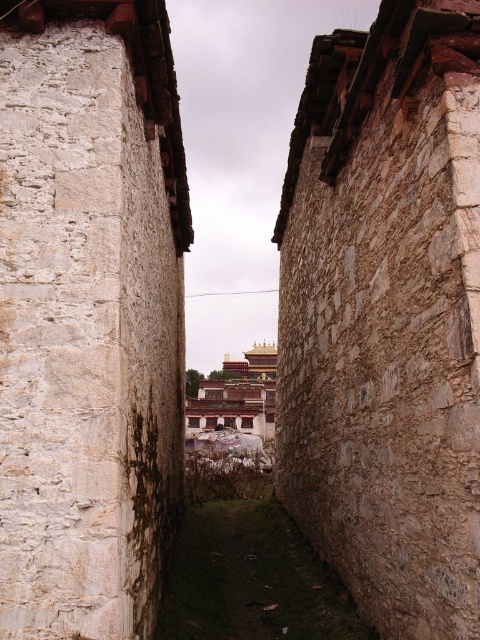
Who is lower down, brown stone wall at right or white stone wall at center?

brown stone wall at right is lower down.

The image size is (480, 640). What do you see at coordinates (386, 316) in the screenshot? I see `brown stone wall at right` at bounding box center [386, 316].

What are the coordinates of `brown stone wall at right` in the screenshot? It's located at [x=386, y=316].

Does white stone wall at center appear on the left side of white stone monastery at center?

No, white stone wall at center is not to the left of white stone monastery at center.

Who is more forward, (95, 628) or (233, 397)?

Point (95, 628) is more forward.

The image size is (480, 640). In order to click on white stone wall at center in this screenshot , I will do `click(88, 314)`.

Is brown stone wall at right shorter than white stone monastery at center?

In fact, brown stone wall at right may be taller than white stone monastery at center.

Locate an element on the screen. The width and height of the screenshot is (480, 640). brown stone wall at right is located at coordinates (386, 316).

Where is `brown stone wall at right`? brown stone wall at right is located at coordinates (386, 316).